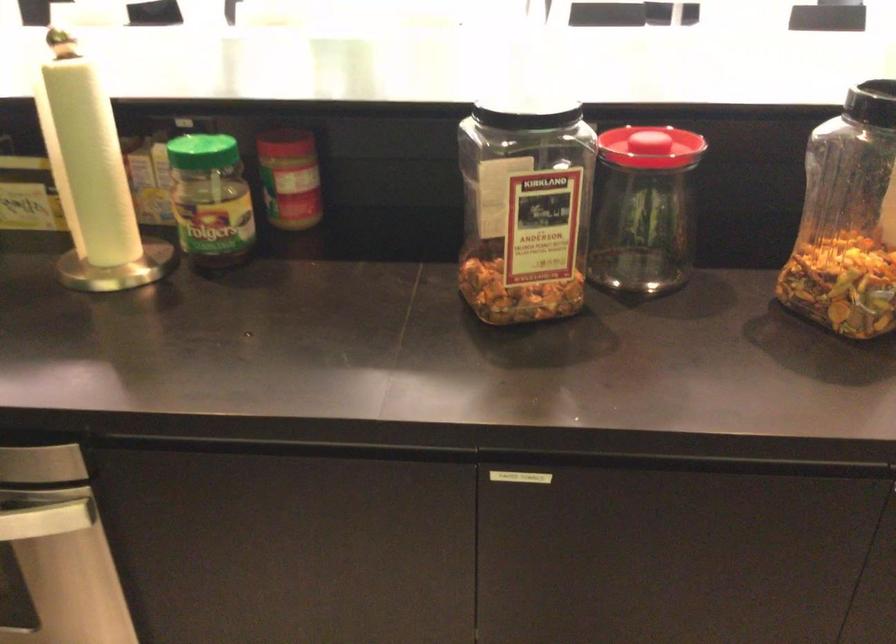
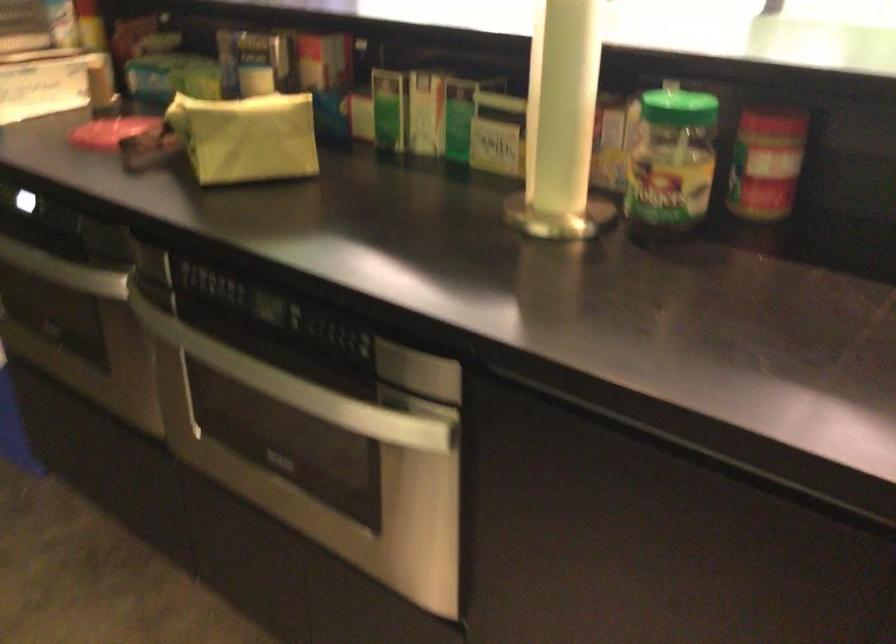
In the second image, find the point that corresponds to [205,152] in the first image.

(678, 108)